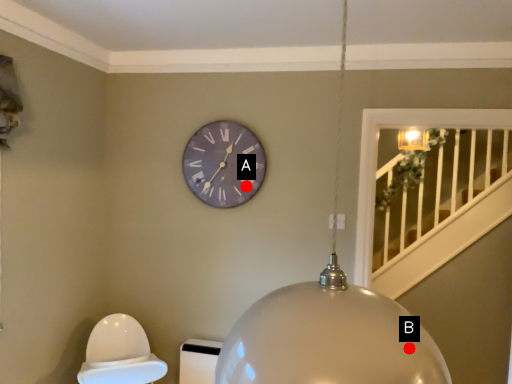
Question: Two points are circled on the image, labeled by A and B beside each circle. Which point is further to the camera?

Choices:
 (A) A is further
 (B) B is further

Answer: (A)